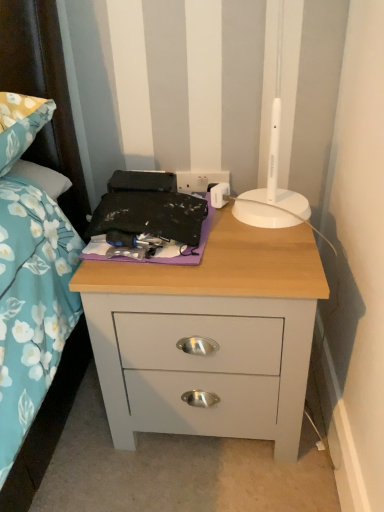
Question: Considering the relative positions of white plastic electric outlet at upper center and matte gray nightstand at center in the image provided, is white plastic electric outlet at upper center behind matte gray nightstand at center?

Choices:
 (A) yes
 (B) no

Answer: (A)

Question: Can you confirm if white plastic electric outlet at upper center is taller than matte gray nightstand at center?

Choices:
 (A) yes
 (B) no

Answer: (B)

Question: Can you confirm if white plastic electric outlet at upper center is positioned to the right of matte gray nightstand at center?

Choices:
 (A) no
 (B) yes

Answer: (A)

Question: Is white plastic electric outlet at upper center oriented towards matte gray nightstand at center?

Choices:
 (A) yes
 (B) no

Answer: (A)

Question: Is white plastic electric outlet at upper center far from matte gray nightstand at center?

Choices:
 (A) yes
 (B) no

Answer: (B)

Question: From a real-world perspective, is white plastic electric outlet at upper center below matte gray nightstand at center?

Choices:
 (A) no
 (B) yes

Answer: (A)

Question: Is white plastic electric outlet at upper center aimed at purple fabric at center?

Choices:
 (A) no
 (B) yes

Answer: (B)

Question: Does white plastic electric outlet at upper center come behind purple fabric at center?

Choices:
 (A) no
 (B) yes

Answer: (B)

Question: Is white plastic electric outlet at upper center surrounding purple fabric at center?

Choices:
 (A) no
 (B) yes

Answer: (A)

Question: Is white plastic electric outlet at upper center positioned in front of purple fabric at center?

Choices:
 (A) yes
 (B) no

Answer: (B)

Question: Is white plastic electric outlet at upper center at the left side of purple fabric at center?

Choices:
 (A) yes
 (B) no

Answer: (B)

Question: From a real-world perspective, is white plastic electric outlet at upper center physically above purple fabric at center?

Choices:
 (A) yes
 (B) no

Answer: (B)

Question: Considering the relative sizes of purple fabric at center and matte gray nightstand at center in the image provided, is purple fabric at center smaller than matte gray nightstand at center?

Choices:
 (A) yes
 (B) no

Answer: (A)